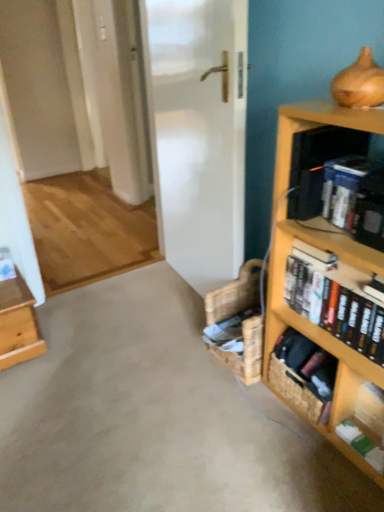
Find the location of `empty space that is ontop of smooth concrete floor at center (from a real-world perspective)`. empty space that is ontop of smooth concrete floor at center (from a real-world perspective) is located at coordinates tap(147, 378).